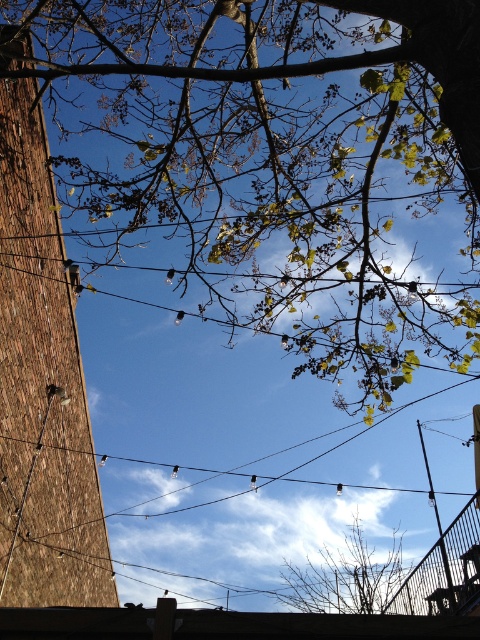
Which is more to the left, black metal fence at lower right or black wire at center?

From the viewer's perspective, black wire at center appears more on the left side.

Can you confirm if black metal fence at lower right is taller than black wire at center?

No, black metal fence at lower right is not taller than black wire at center.

Identify the location of black metal fence at lower right. The width and height of the screenshot is (480, 640). (444, 570).

Consider the image. Can you confirm if bare branches at center is positioned to the left of black wire at center?

Incorrect, bare branches at center is not on the left side of black wire at center.

Who is more forward, (393,556) or (385,486)?

Point (385,486) is more forward.

Find the location of a particular element. This screenshot has width=480, height=640. bare branches at center is located at coordinates (345, 577).

Does point (63, 92) come farther from viewer compared to point (140, 461)?

No, (63, 92) is closer to viewer.

The width and height of the screenshot is (480, 640). In order to click on green leafy tree at upper center in this screenshot , I will do `click(276, 152)`.

Image resolution: width=480 pixels, height=640 pixels. Identify the location of green leafy tree at upper center. (276, 152).